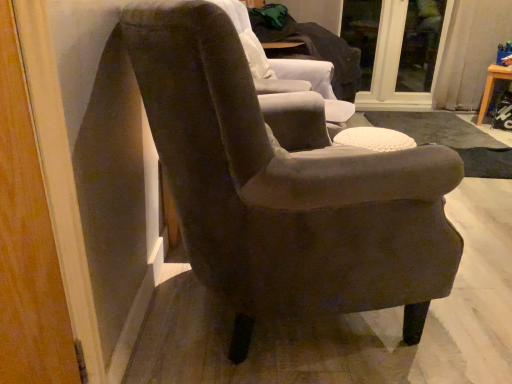
Question: Considering the positions of point (485, 110) and point (326, 77), is point (485, 110) closer or farther from the camera than point (326, 77)?

Choices:
 (A) farther
 (B) closer

Answer: (A)

Question: From the image's perspective, is wooden stool at right located above or below velvet-like brown armchair at center, placed as the second chair when sorted from front to back?

Choices:
 (A) below
 (B) above

Answer: (A)

Question: Estimate the real-world distances between objects in this image. Which object is farther from the transparent glass door at upper right, acting as the first glass door starting from the right?

Choices:
 (A) velvet-like brown armchair at center, which appears as the 1th chair when viewed from the back
 (B) suede-like brown armchair at center, marked as the second chair in a back-to-front arrangement
 (C) wooden stool at right
 (D) transparent glass door at upper center, positioned as the first glass door in left-to-right order

Answer: (B)

Question: Considering the real-world distances, which object is closest to the transparent glass door at upper right, acting as the first glass door starting from the right?

Choices:
 (A) wooden stool at right
 (B) velvet-like brown armchair at center, which appears as the 1th chair when viewed from the back
 (C) suede-like brown armchair at center, marked as the second chair in a back-to-front arrangement
 (D) transparent glass door at upper center, which appears as the second glass door when viewed from the right

Answer: (D)